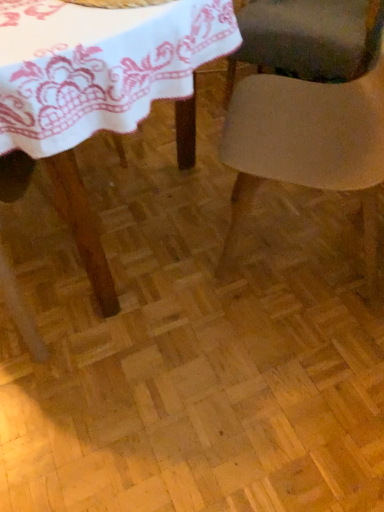
Question: From a real-world perspective, is smooth beige chair at center, placed as the second chair when sorted from top to bottom, above or below white lace tablecloth at upper left?

Choices:
 (A) below
 (B) above

Answer: (A)

Question: Visually, is smooth beige chair at center, which appears as the second chair when viewed from the back, positioned to the left or to the right of white lace tablecloth at upper left?

Choices:
 (A) left
 (B) right

Answer: (B)

Question: Based on their relative distances, which object is nearer to the white lace tablecloth at upper left?

Choices:
 (A) smooth beige chair at center, which appears as the second chair when viewed from the back
 (B) matte gray chair at center, which is counted as the first chair, starting from the back

Answer: (A)

Question: Which is farther from the white lace tablecloth at upper left?

Choices:
 (A) smooth beige chair at center, placed as the second chair when sorted from top to bottom
 (B) matte gray chair at center, the second chair from the front

Answer: (B)